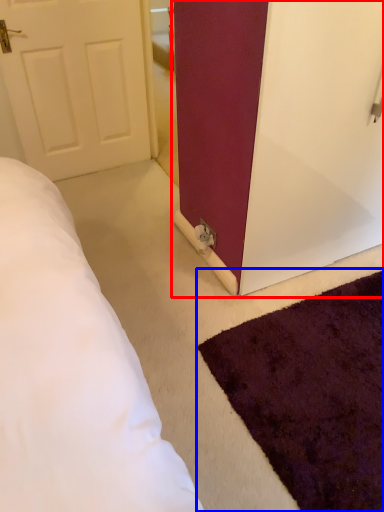
Question: Which point is further to the camera, door (highlighted by a red box) or mat (highlighted by a blue box)?

Choices:
 (A) door
 (B) mat

Answer: (A)